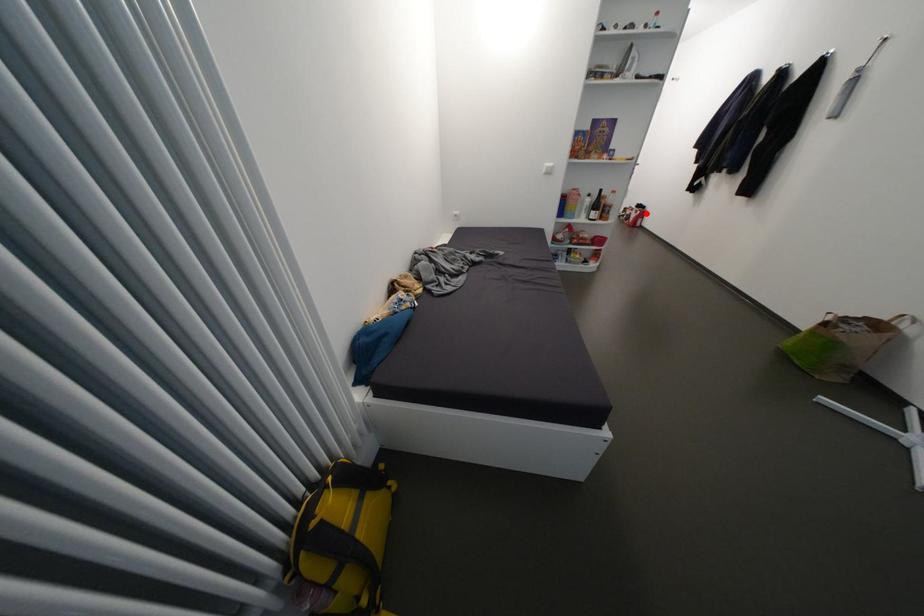
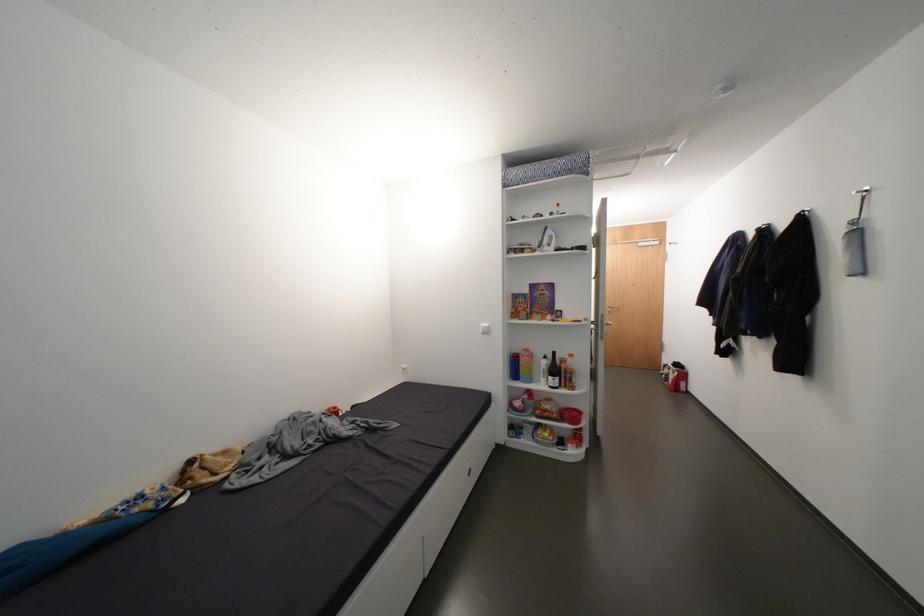
The point at the highlighted location is marked in the first image. Where is the corresponding point in the second image?

(684, 374)